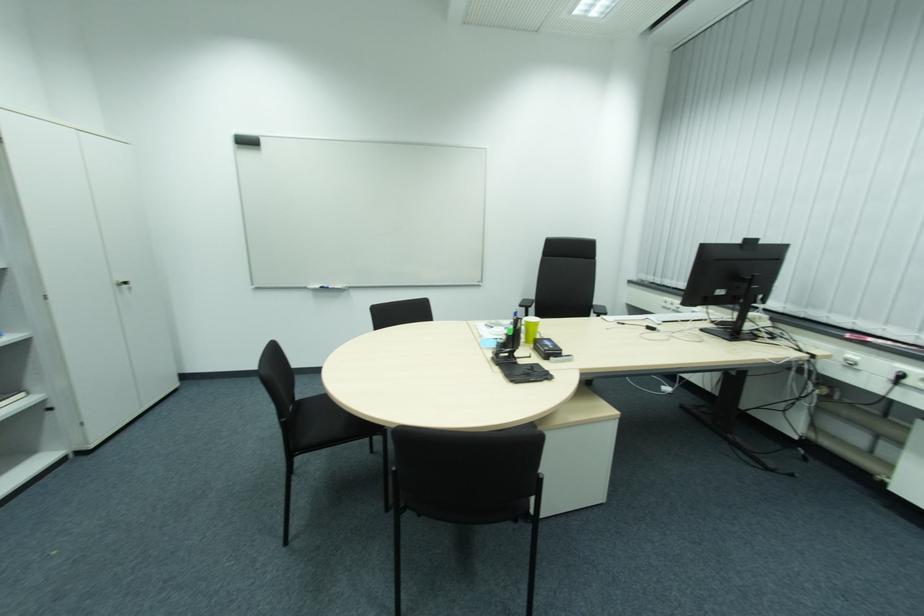
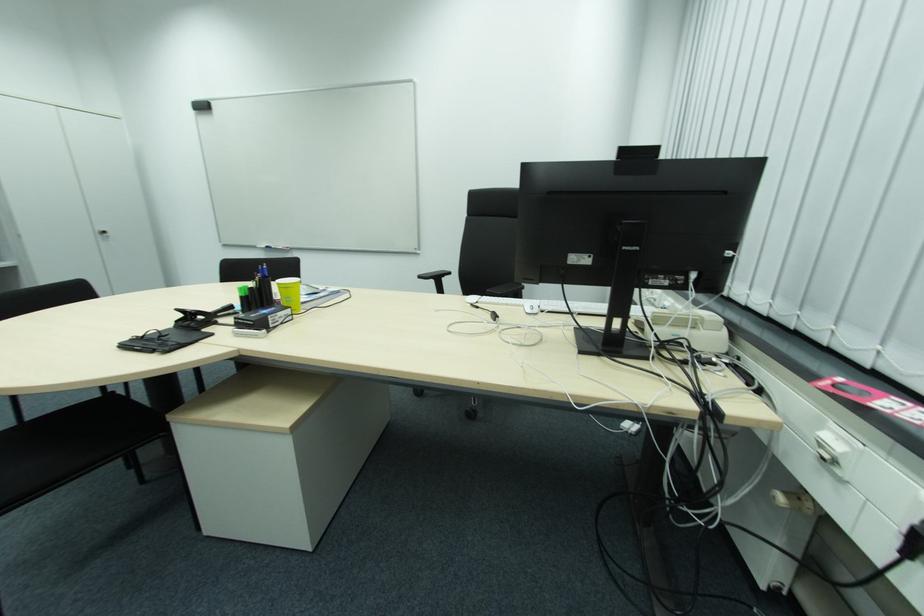
Which direction would the cameraman need to move to produce the second image?

The cameraman walked toward right, forward.